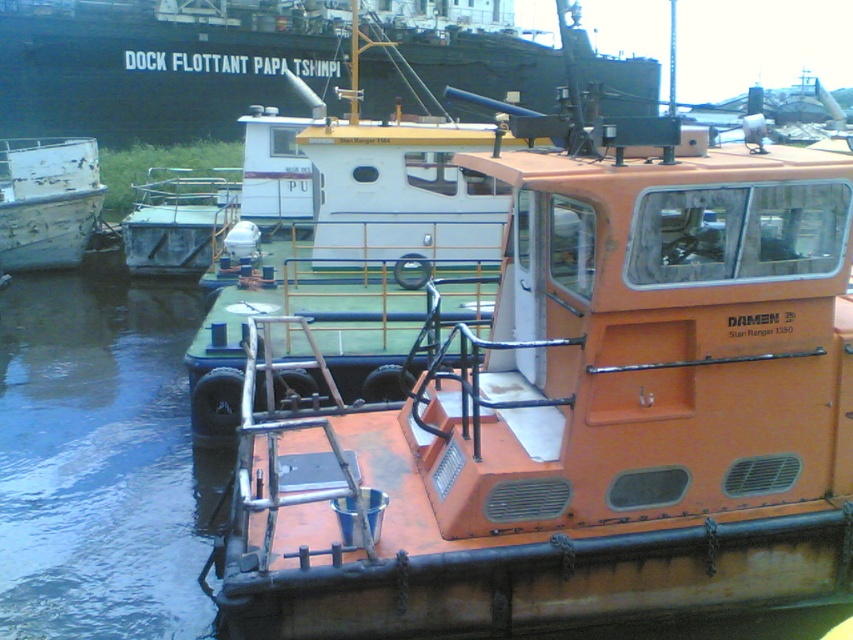
Is orange matte boat at center thinner than green matte tugboat at center?

Indeed, orange matte boat at center has a lesser width compared to green matte tugboat at center.

Who is positioned more to the right, orange matte boat at center or green matte tugboat at center?

Positioned to the right is orange matte boat at center.

Which is in front, point (387, 408) or point (404, 225)?

Positioned in front is point (387, 408).

Locate an element on the screen. The image size is (853, 640). orange matte boat at center is located at coordinates (573, 417).

Can you confirm if orange matte boat at center is thinner than dark blue water at lower left?

Yes.

The width and height of the screenshot is (853, 640). What do you see at coordinates (573, 417) in the screenshot?
I see `orange matte boat at center` at bounding box center [573, 417].

The width and height of the screenshot is (853, 640). Describe the element at coordinates (573, 417) in the screenshot. I see `orange matte boat at center` at that location.

This screenshot has height=640, width=853. What are the coordinates of `orange matte boat at center` in the screenshot? It's located at (573, 417).

Is dark blue water at lower left bigger than green matte tugboat at center?

Incorrect, dark blue water at lower left is not larger than green matte tugboat at center.

Image resolution: width=853 pixels, height=640 pixels. What do you see at coordinates (97, 460) in the screenshot? I see `dark blue water at lower left` at bounding box center [97, 460].

The height and width of the screenshot is (640, 853). I want to click on dark blue water at lower left, so pyautogui.click(x=97, y=460).